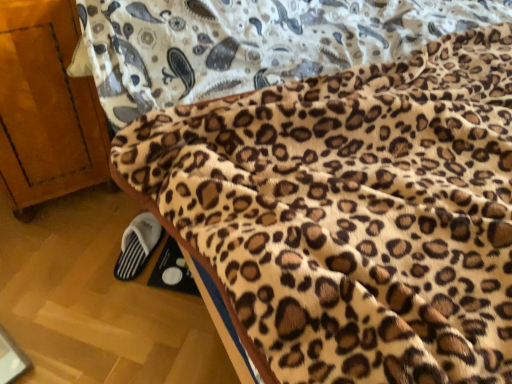
In order to face leopard print fleece blanket at lower right, should I rotate leftwards or rightwards?

Rotate your view right by about 11.085°.

Locate an element on the screen. white fabric slipper at lower left is located at coordinates (137, 246).

From the image's perspective, between wooden cabinet at left and leopard print fleece blanket at lower right, who is located below?

leopard print fleece blanket at lower right.

Considering the relative sizes of wooden cabinet at left and leopard print fleece blanket at lower right in the image provided, is wooden cabinet at left thinner than leopard print fleece blanket at lower right?

Correct, the width of wooden cabinet at left is less than that of leopard print fleece blanket at lower right.

From their relative heights in the image, would you say wooden cabinet at left is taller or shorter than leopard print fleece blanket at lower right?

Clearly, wooden cabinet at left is taller compared to leopard print fleece blanket at lower right.

Considering the relative sizes of wooden cabinet at left and leopard print fleece blanket at lower right in the image provided, is wooden cabinet at left bigger than leopard print fleece blanket at lower right?

Result: Indeed, wooden cabinet at left has a larger size compared to leopard print fleece blanket at lower right.

Is leopard print fleece blanket at lower right directly adjacent to white fabric slipper at lower left?

leopard print fleece blanket at lower right is not next to white fabric slipper at lower left, and they're not touching.

I want to click on footwear behind the leopard print fleece blanket at lower right, so click(137, 246).

In the scene shown: Is leopard print fleece blanket at lower right spatially inside white fabric slipper at lower left, or outside of it?

The correct answer is: outside.

Considering the positions of objects leopard print fleece blanket at lower right and white fabric slipper at lower left in the image provided, who is more to the right, leopard print fleece blanket at lower right or white fabric slipper at lower left?

From the viewer's perspective, leopard print fleece blanket at lower right appears more on the right side.

From a real-world perspective, who is located lower, white fabric slipper at lower left or wooden cabinet at left?

white fabric slipper at lower left, from a real-world perspective.

Is the surface of white fabric slipper at lower left in direct contact with wooden cabinet at left?

white fabric slipper at lower left is not next to wooden cabinet at left, and they're not touching.

Consider the image. Is white fabric slipper at lower left oriented towards wooden cabinet at left?

No, white fabric slipper at lower left is not aimed at wooden cabinet at left.

Is white fabric slipper at lower left surrounding wooden cabinet at left?

No, white fabric slipper at lower left does not contain wooden cabinet at left.

Which is closer to the camera, (x=72, y=39) or (x=132, y=241)?

Point (x=72, y=39) is closer to the camera than point (x=132, y=241).

Can you confirm if wooden cabinet at left is positioned to the right of white fabric slipper at lower left?

No, wooden cabinet at left is not to the right of white fabric slipper at lower left.

Image resolution: width=512 pixels, height=384 pixels. What are the coordinates of `footwear that appears behind the wooden cabinet at left` in the screenshot? It's located at (137, 246).

How many degrees apart are the facing directions of wooden cabinet at left and white fabric slipper at lower left?

They differ by 138 degrees in their facing directions.

Where is `blanket on the right of wooden cabinet at left`? Image resolution: width=512 pixels, height=384 pixels. blanket on the right of wooden cabinet at left is located at coordinates (353, 213).

How different are the orientations of leopard print fleece blanket at lower right and wooden cabinet at left in degrees?

93.6 degrees.

Is point (260, 342) positioned in front of point (12, 71)?

Yes, it is.

Considering the relative sizes of white fabric slipper at lower left and leopard print fleece blanket at lower right in the image provided, is white fabric slipper at lower left thinner than leopard print fleece blanket at lower right?

Indeed, white fabric slipper at lower left has a lesser width compared to leopard print fleece blanket at lower right.

Is white fabric slipper at lower left to the left of leopard print fleece blanket at lower right from the viewer's perspective?

Indeed, white fabric slipper at lower left is positioned on the left side of leopard print fleece blanket at lower right.

Which object is more forward, white fabric slipper at lower left or leopard print fleece blanket at lower right?

leopard print fleece blanket at lower right.

Where is `blanket that is on the right side of wooden cabinet at left`? The width and height of the screenshot is (512, 384). blanket that is on the right side of wooden cabinet at left is located at coordinates (353, 213).

I want to click on footwear below the leopard print fleece blanket at lower right (from the image's perspective), so click(x=137, y=246).

From the image, which object appears to be farther from wooden cabinet at left, leopard print fleece blanket at lower right or white fabric slipper at lower left?

leopard print fleece blanket at lower right is positioned further to the anchor wooden cabinet at left.

When comparing their distances from wooden cabinet at left, does white fabric slipper at lower left or leopard print fleece blanket at lower right seem closer?

white fabric slipper at lower left.

Estimate the real-world distances between objects in this image. Which object is closer to leopard print fleece blanket at lower right, wooden cabinet at left or white fabric slipper at lower left?

Among the two, wooden cabinet at left is located nearer to leopard print fleece blanket at lower right.

Based on the photo, estimate the real-world distances between objects in this image. Which object is closer to white fabric slipper at lower left, wooden cabinet at left or leopard print fleece blanket at lower right?

wooden cabinet at left is closer to white fabric slipper at lower left.

From the image, which object appears to be nearer to leopard print fleece blanket at lower right, white fabric slipper at lower left or wooden cabinet at left?

Among the two, wooden cabinet at left is located nearer to leopard print fleece blanket at lower right.

Considering their positions, is leopard print fleece blanket at lower right positioned further to white fabric slipper at lower left than wooden cabinet at left?

leopard print fleece blanket at lower right is positioned further to the anchor white fabric slipper at lower left.

I want to click on footwear between wooden cabinet at left and leopard print fleece blanket at lower right from left to right, so click(x=137, y=246).